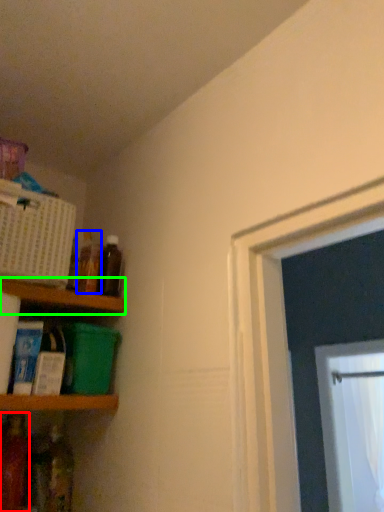
Question: Estimate the real-world distances between objects in this image. Which object is farther from bottle (highlighted by a red box), bottle (highlighted by a blue box) or shelf (highlighted by a green box)?

Choices:
 (A) bottle
 (B) shelf

Answer: (A)